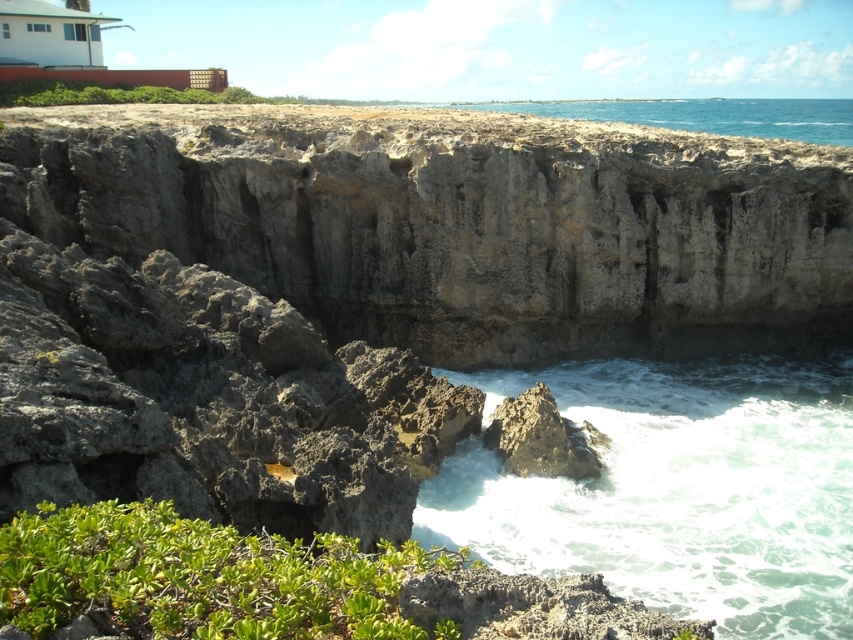
Question: Can you confirm if white frothy water at lower center is thinner than blue water at upper center?

Choices:
 (A) no
 (B) yes

Answer: (B)

Question: Is white frothy water at lower center below blue water at upper center?

Choices:
 (A) yes
 (B) no

Answer: (A)

Question: Which of the following is the farthest from the observer?

Choices:
 (A) (663, 120)
 (B) (547, 449)
 (C) (579, 406)

Answer: (A)

Question: Can you confirm if white frothy water at lower center is thinner than rough textured rock at lower center?

Choices:
 (A) no
 (B) yes

Answer: (A)

Question: Which point is closer to the camera?

Choices:
 (A) (846, 112)
 (B) (728, 616)
 (C) (524, 451)

Answer: (B)

Question: Which point appears farthest from the camera in this image?

Choices:
 (A) (572, 433)
 (B) (808, 444)
 (C) (737, 113)

Answer: (C)